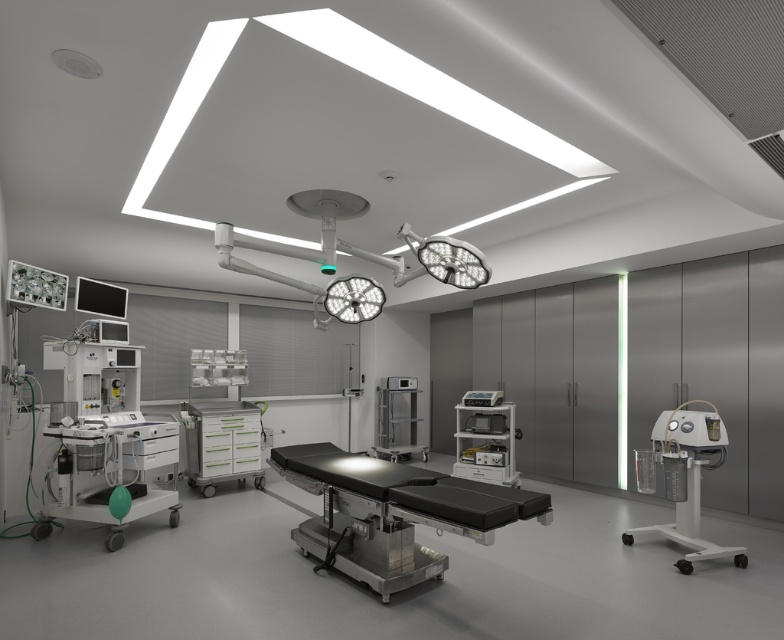
You are a medical technician preparing for surgery. You need to place a 2.5 meter long medical instrument on the floor between the black matte surgical table at center and the white plastic medical cart at center. Is there enough space between them to accommodate the instrument without moving either object?

The black matte surgical table at center might be wider than the white plastic medical cart at center, so there is uncertainty about the available space. To safely place the 2.5 meter instrument, you should first measure the distance between the two objects to ensure it can fit without obstruction.

You are a surgeon preparing for an operation and need to quickly access the tools from both the white glossy tool chest at center and the satin silver medical cart at center. Which one will you reach first without moving your position?

You will reach the white glossy tool chest at center first because it is closer to you than the satin silver medical cart at center.

You are a nurse preparing for surgery and need to place a 1.2 meter long medical tray between the white glossy tool chest at center and the satin silver medical cart at center. Can you fit it there?

The white glossy tool chest at center is wider than the satin silver medical cart at center, so the combined width of both objects may exceed the available space for placing a 1.2 meter long medical tray. Check the total space between them first.